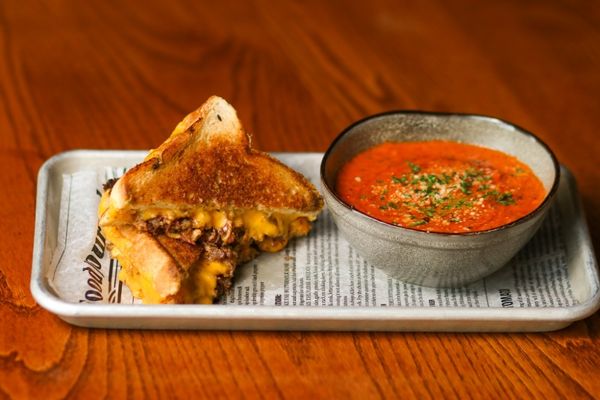
Find the location of a particular element. inside of bowl is located at coordinates (380, 134).